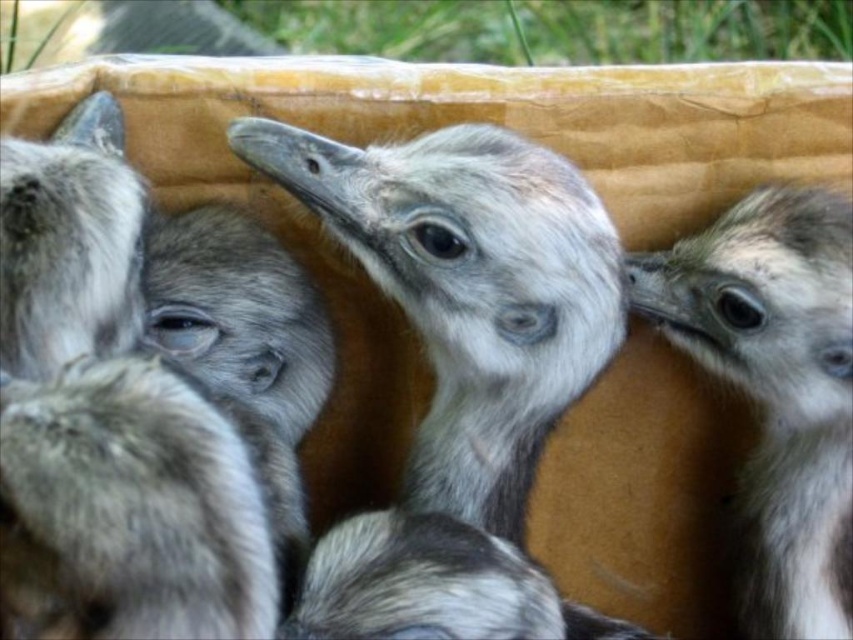
Question: Can you confirm if gray downy ostrich at center is positioned below gray fluffy ostrich at center?

Choices:
 (A) no
 (B) yes

Answer: (A)

Question: Among these points, which one is farthest from the camera?

Choices:
 (A) (693, 284)
 (B) (469, 458)

Answer: (A)

Question: Which point appears farthest from the camera in this image?

Choices:
 (A) (848, 554)
 (B) (485, 305)

Answer: (A)

Question: Is gray downy ostrich at center to the right of gray fluffy ostrich at center from the viewer's perspective?

Choices:
 (A) no
 (B) yes

Answer: (A)

Question: Does gray downy ostrich at center appear on the left side of gray fluffy ostrich at center?

Choices:
 (A) no
 (B) yes

Answer: (B)